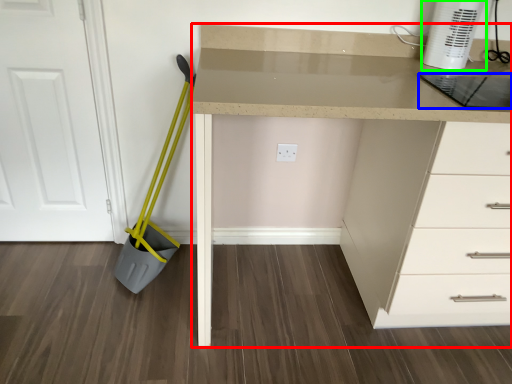
Question: Which object is the farthest from computer desk (highlighted by a red box)? Choose among these: kitchen appliance (highlighted by a blue box) or home appliance (highlighted by a green box).

Choices:
 (A) kitchen appliance
 (B) home appliance

Answer: (B)